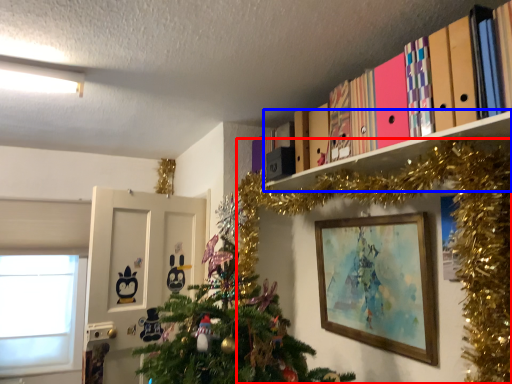
Question: Which object appears farthest to the camera in this image, christmas tree (highlighted by a red box) or shelf (highlighted by a blue box)?

Choices:
 (A) christmas tree
 (B) shelf

Answer: (B)